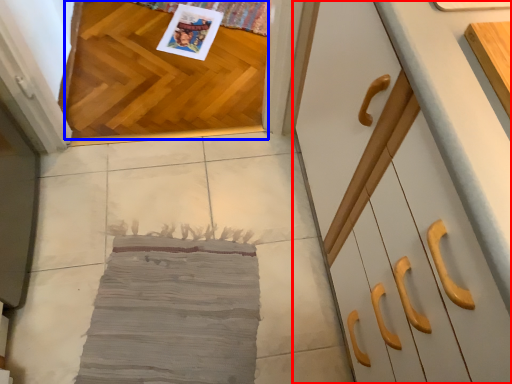
Question: Which of the following is the farthest to the observer, cabinetry (highlighted by a red box) or hardwood (highlighted by a blue box)?

Choices:
 (A) cabinetry
 (B) hardwood

Answer: (B)